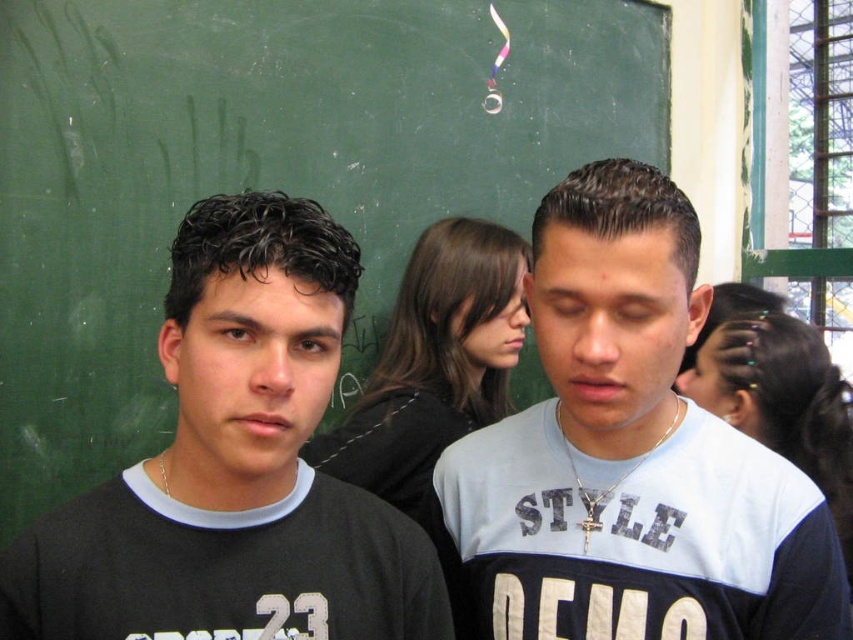
You are a student sitting in the classroom and need to write something on the green chalkboard at upper center. Can you reach it while standing on the black matte shirt at center?

The green chalkboard at upper center is taller than the black matte shirt at center, so you can reach it by standing on the black matte shirt at center.